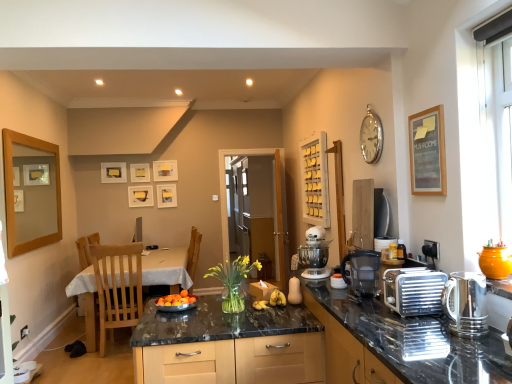
Where is `vacant area that is in front of sleek metallic kettle at right, acting as the second kitchen appliance starting from the back`? vacant area that is in front of sleek metallic kettle at right, acting as the second kitchen appliance starting from the back is located at coordinates (479, 344).